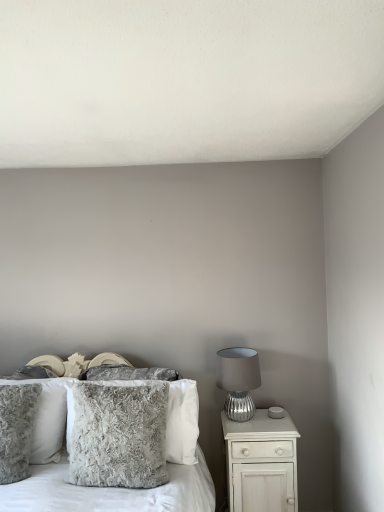
Find the location of a particular element. This screenshot has width=384, height=512. vacant space situated above silver textured lamp at right (from a real-world perspective) is located at coordinates (235, 352).